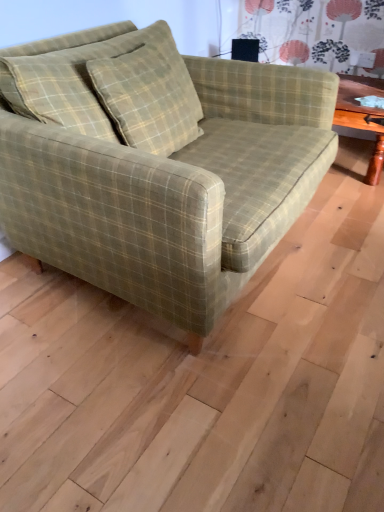
Question: Is green plaid fabric couch at center smaller than green plaid pillow at center?

Choices:
 (A) yes
 (B) no

Answer: (B)

Question: Is green plaid fabric couch at center far from green plaid pillow at center?

Choices:
 (A) yes
 (B) no

Answer: (B)

Question: Does green plaid fabric couch at center lie in front of green plaid pillow at center?

Choices:
 (A) no
 (B) yes

Answer: (B)

Question: Considering the relative positions of green plaid fabric couch at center and green plaid pillow at center in the image provided, is green plaid fabric couch at center to the right of green plaid pillow at center from the viewer's perspective?

Choices:
 (A) no
 (B) yes

Answer: (B)

Question: Is green plaid fabric couch at center surrounding green plaid pillow at center?

Choices:
 (A) yes
 (B) no

Answer: (A)

Question: Is green plaid fabric couch at center turned away from green plaid pillow at center?

Choices:
 (A) no
 (B) yes

Answer: (B)

Question: From a real-world perspective, is green plaid pillow at center on top of green plaid fabric couch at center?

Choices:
 (A) yes
 (B) no

Answer: (A)

Question: From a real-world perspective, is green plaid pillow at center beneath green plaid fabric couch at center?

Choices:
 (A) no
 (B) yes

Answer: (A)

Question: Considering the relative sizes of green plaid pillow at center and green plaid fabric couch at center in the image provided, is green plaid pillow at center shorter than green plaid fabric couch at center?

Choices:
 (A) no
 (B) yes

Answer: (B)

Question: Does green plaid pillow at center have a lesser width compared to green plaid fabric couch at center?

Choices:
 (A) yes
 (B) no

Answer: (A)

Question: Is the depth of green plaid pillow at center greater than that of green plaid fabric couch at center?

Choices:
 (A) no
 (B) yes

Answer: (B)

Question: Can you confirm if green plaid pillow at center is positioned to the left of green plaid fabric couch at center?

Choices:
 (A) yes
 (B) no

Answer: (A)

Question: Considering the positions of point (130, 109) and point (153, 73), is point (130, 109) closer or farther from the camera than point (153, 73)?

Choices:
 (A) farther
 (B) closer

Answer: (B)